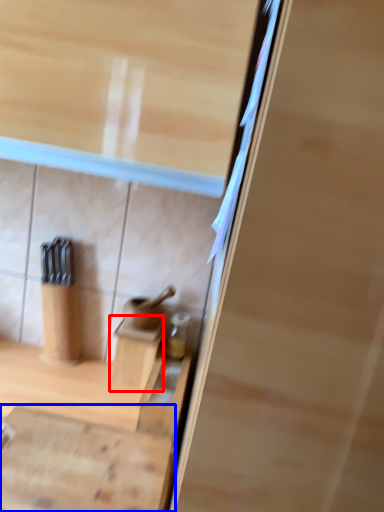
Question: Which object is further to the camera taking this photo, cabinetry (highlighted by a red box) or cabinetry (highlighted by a blue box)?

Choices:
 (A) cabinetry
 (B) cabinetry

Answer: (A)